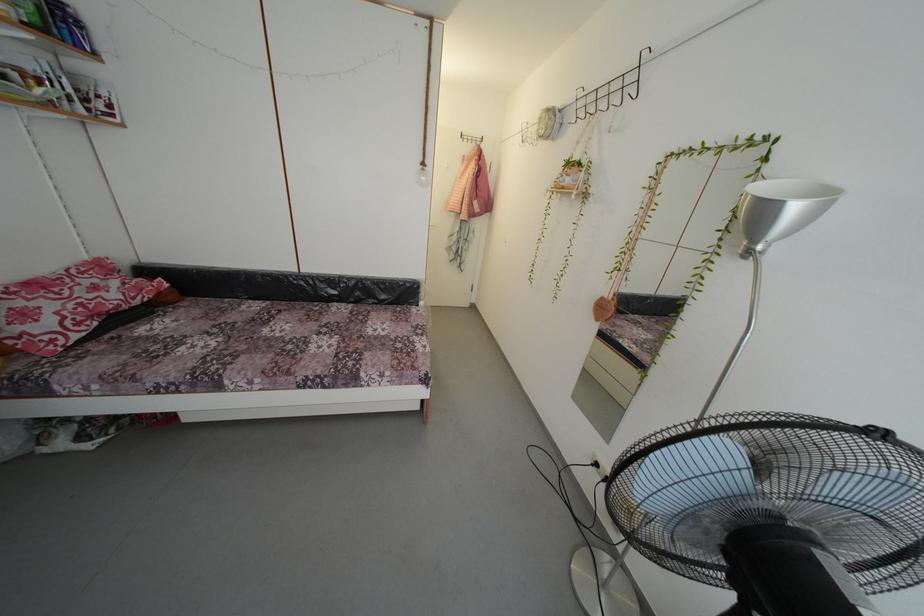
The image size is (924, 616). Identify the location of black wall hook. (608, 92).